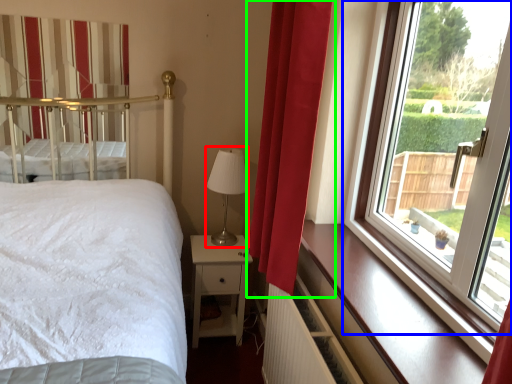
Question: Estimate the real-world distances between objects in this image. Which object is farther from table lamp (highlighted by a red box), window (highlighted by a blue box) or curtain (highlighted by a green box)?

Choices:
 (A) window
 (B) curtain

Answer: (A)